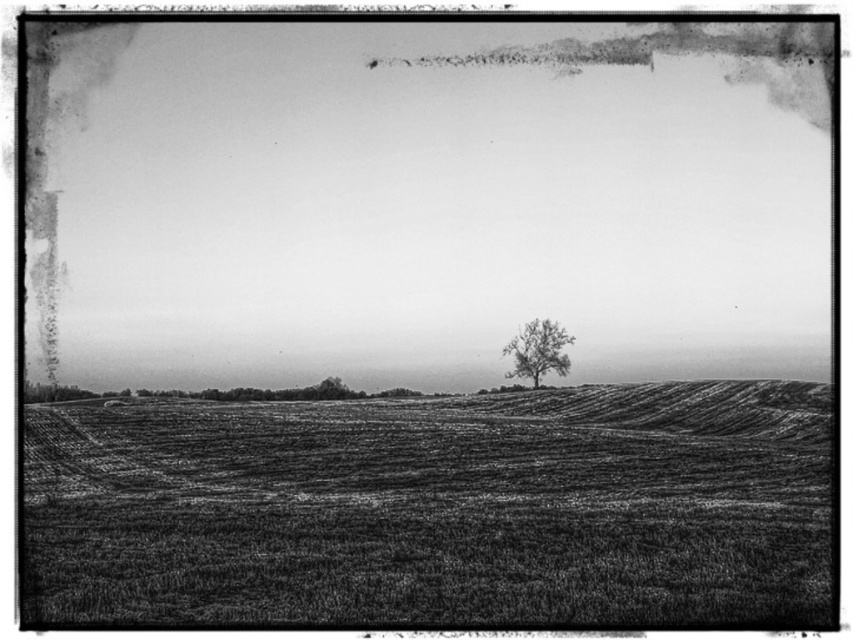
You are a farmer planning to plant crops in the grainy soil field at center. You have a tractor that is 3 meters wide. Can the tractor pass through the bare branch tree at center without damaging it?

The grainy soil field at center might be wider than the bare branch tree at center, but the description does not provide specific measurements about the width of the tree or the field. Therefore, it is uncertain whether the tractor can pass through safely without damaging the tree.

You are standing in the middle of the field looking towards the horizon. Which object is closer to you, the smooth soil at center or the bare branch tree at center?

The smooth soil at center is closer to you because it is further to the viewer than the bare branch tree at center.